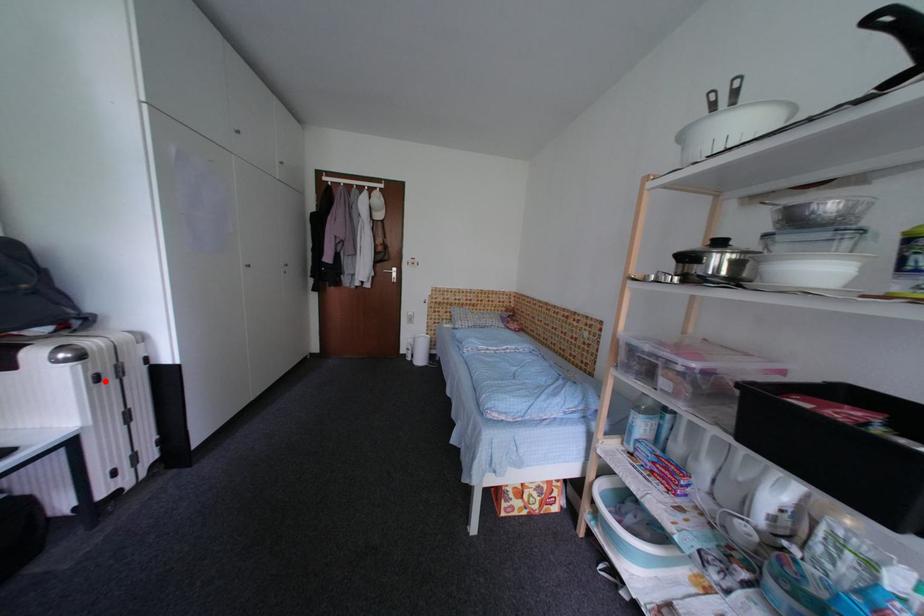
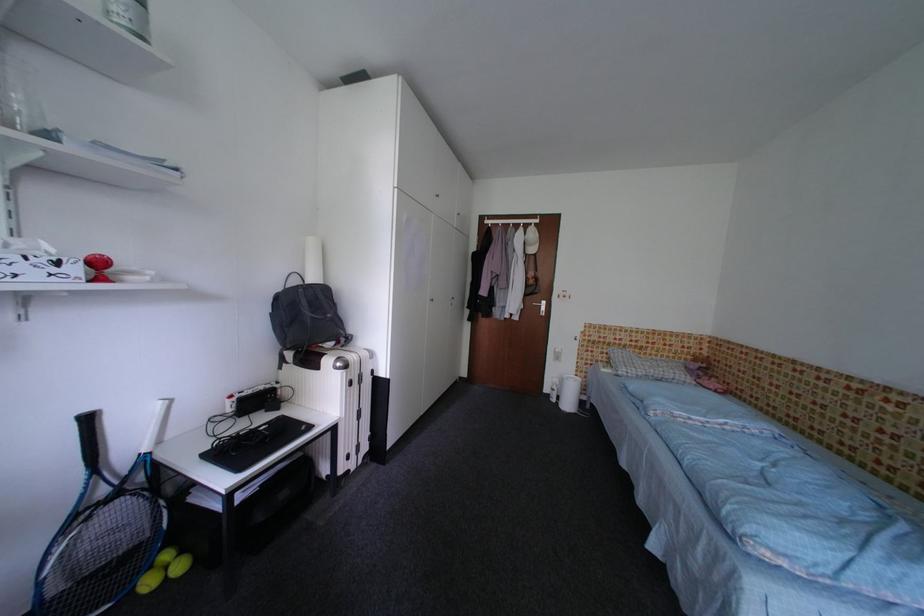
Question: I am providing you with two images of the same scene from different viewpoints. In image1, a red point is highlighted. Considering the same 3D point in image2, which of the following is correct?

Choices:
 (A) It is closer
 (B) It is farther

Answer: (B)